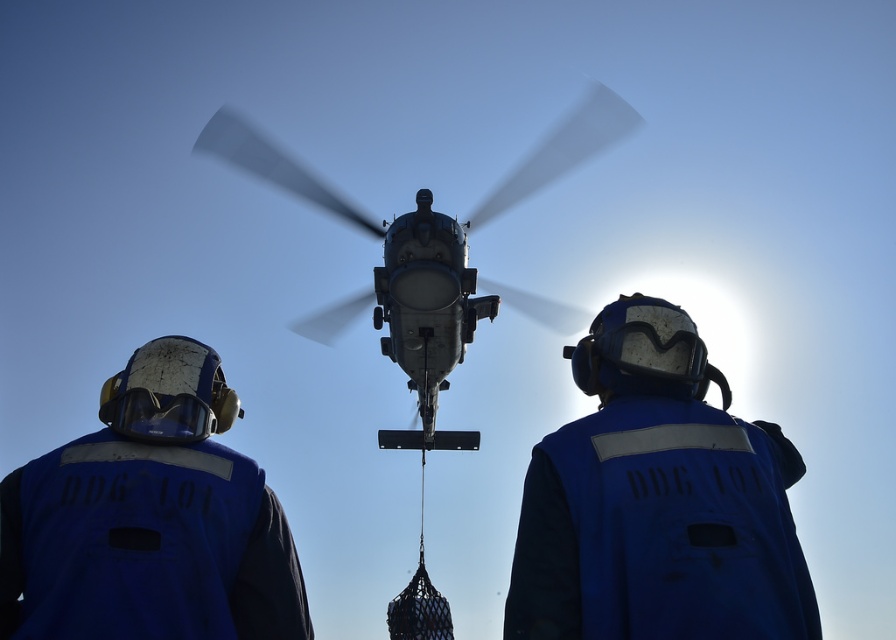
Question: Which of the following is the closest to the observer?

Choices:
 (A) (224, 483)
 (B) (166, 435)
 (C) (720, 433)
 (D) (349, 312)

Answer: (A)

Question: Which of the following is the farthest from the observer?

Choices:
 (A) (714, 573)
 (B) (441, 289)
 (C) (154, 488)
 (D) (177, 424)

Answer: (B)

Question: Can you confirm if blue matte vest at center is positioned below transparent plastic goggles at center?

Choices:
 (A) yes
 (B) no

Answer: (A)

Question: Does blue matte vest at center appear on the left side of transparent plastic goggles at center?

Choices:
 (A) yes
 (B) no

Answer: (B)

Question: Can you confirm if blue fabric helmet at center is bigger than blue matte vest at center?

Choices:
 (A) no
 (B) yes

Answer: (B)

Question: Among these points, which one is farthest from the camera?

Choices:
 (A) (659, 368)
 (B) (140, 404)
 (C) (114, 419)
 (D) (548, 163)

Answer: (D)